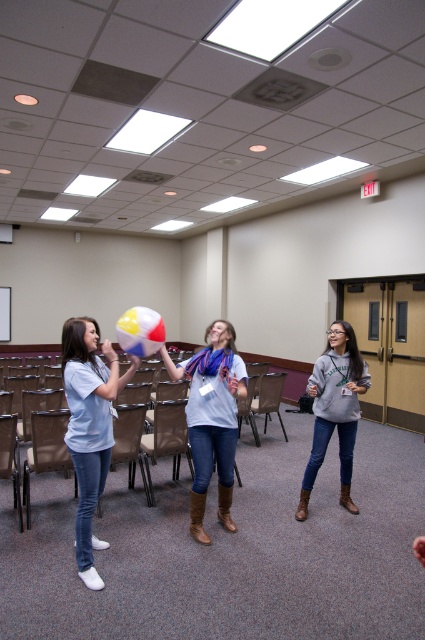
Does matte white scarf at center have a smaller size compared to gray fleece sweatshirt at right?

Incorrect, matte white scarf at center is not smaller in size than gray fleece sweatshirt at right.

What do you see at coordinates (212, 419) in the screenshot? I see `matte white scarf at center` at bounding box center [212, 419].

At what (x,y) coordinates should I click in order to perform the action: click on matte white scarf at center. Please return your answer as a coordinate pair (x, y). The image size is (425, 640). Looking at the image, I should click on (212, 419).

What do you see at coordinates (25, 355) in the screenshot? I see `brown fabric chair at center` at bounding box center [25, 355].

Can you confirm if brown fabric chair at center is positioned to the right of multicolored fabric beach ball at center?

Incorrect, brown fabric chair at center is not on the right side of multicolored fabric beach ball at center.

This screenshot has height=640, width=425. Describe the element at coordinates (25, 355) in the screenshot. I see `brown fabric chair at center` at that location.

This screenshot has width=425, height=640. Identify the location of brown fabric chair at center. (25, 355).

Does matte blue shirt at left have a greater height compared to gray fleece sweatshirt at right?

Indeed, matte blue shirt at left has a greater height compared to gray fleece sweatshirt at right.

Does matte blue shirt at left lie behind gray fleece sweatshirt at right?

No.

The height and width of the screenshot is (640, 425). Identify the location of matte blue shirt at left. (90, 426).

Find the location of a particular element. matte blue shirt at left is located at coordinates (90, 426).